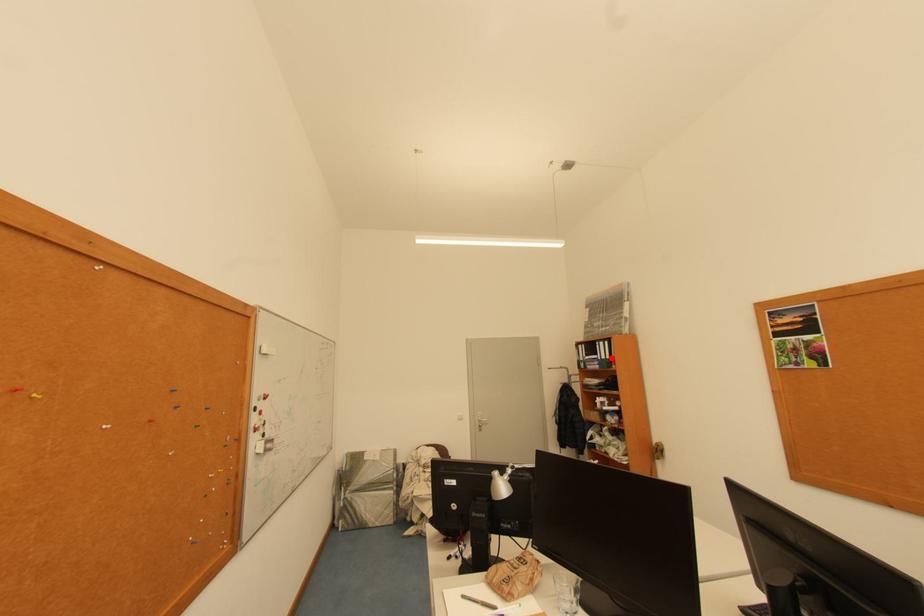
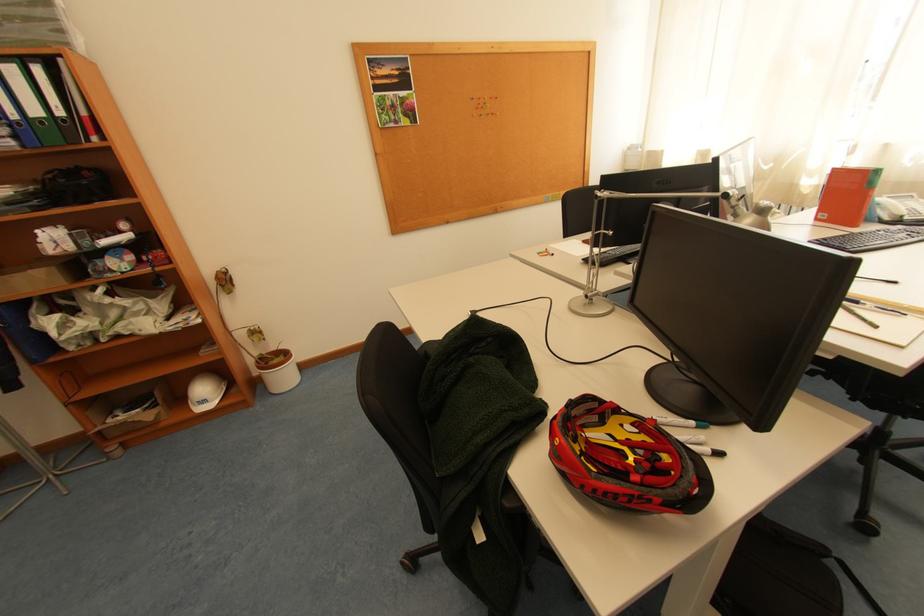
Question: I am providing you with two images of the same scene from different viewpoints. In image1, a red point is highlighted. Considering the same 3D point in image2, which of the following is correct?

Choices:
 (A) It is closer
 (B) It is farther

Answer: (B)